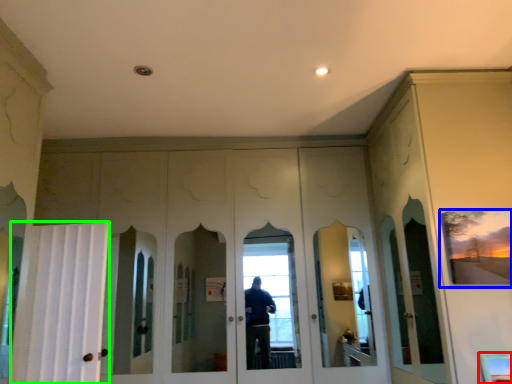
Question: Considering the real-world distances, which object is closest to window (highlighted by a red box)? picture frame (highlighted by a blue box) or curtain (highlighted by a green box).

Choices:
 (A) picture frame
 (B) curtain

Answer: (A)